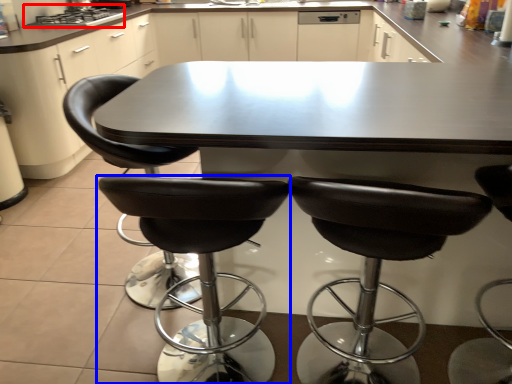
Question: Which object is closer to the camera taking this photo, stove (highlighted by a red box) or chair (highlighted by a blue box)?

Choices:
 (A) stove
 (B) chair

Answer: (B)